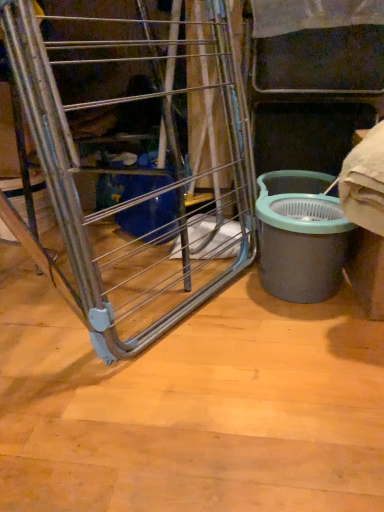
Where is `matte gray bucket at right`? The height and width of the screenshot is (512, 384). matte gray bucket at right is located at coordinates (300, 236).

Measure the distance between point (291, 175) and camera.

They are 1.21 meters apart.

This screenshot has height=512, width=384. What do you see at coordinates (300, 236) in the screenshot? I see `matte gray bucket at right` at bounding box center [300, 236].

This screenshot has height=512, width=384. Describe the element at coordinates (136, 169) in the screenshot. I see `metallic silver ladder at center` at that location.

Locate an element on the screen. Image resolution: width=384 pixels, height=512 pixels. metallic silver ladder at center is located at coordinates (136, 169).

You are a GUI agent. You are given a task and a screenshot of the screen. Output one action in this format:
    pyautogui.click(x=<x>, y=<y>)
    Task: Click on the matte gray bucket at right
    The width and height of the screenshot is (384, 512).
    Given the screenshot: What is the action you would take?
    pyautogui.click(x=300, y=236)

Is matte gray bucket at right to the right of metallic silver ladder at center from the viewer's perspective?

Yes.

Which object is closer to the camera, matte gray bucket at right or metallic silver ladder at center?

metallic silver ladder at center is in front.

Considering the points (284, 239) and (23, 232), which point is in front, point (284, 239) or point (23, 232)?

Positioned in front is point (23, 232).

Based on the photo, from the image's perspective, who appears lower, matte gray bucket at right or metallic silver ladder at center?

From the image's view, matte gray bucket at right is below.

From a real-world perspective, is matte gray bucket at right above or below metallic silver ladder at center?

matte gray bucket at right is situated lower than metallic silver ladder at center in the real world.

Does matte gray bucket at right have a lesser width compared to metallic silver ladder at center?

No.

Considering the relative sizes of matte gray bucket at right and metallic silver ladder at center in the image provided, is matte gray bucket at right shorter than metallic silver ladder at center?

Yes, matte gray bucket at right is shorter than metallic silver ladder at center.

Considering the relative sizes of matte gray bucket at right and metallic silver ladder at center in the image provided, is matte gray bucket at right bigger than metallic silver ladder at center?

Actually, matte gray bucket at right might be smaller than metallic silver ladder at center.

Would you say matte gray bucket at right is outside metallic silver ladder at center?

Yes, matte gray bucket at right is outside of metallic silver ladder at center.

Is matte gray bucket at right touching metallic silver ladder at center?

They are not placed beside each other.

Could you tell me if matte gray bucket at right is facing metallic silver ladder at center?

No, matte gray bucket at right does not turn towards metallic silver ladder at center.

What's the angular difference between matte gray bucket at right and metallic silver ladder at center's facing directions?

The angle between the facing direction of matte gray bucket at right and the facing direction of metallic silver ladder at center is 60.5 degrees.

Locate an element on the screen. This screenshot has height=512, width=384. waste container that is below the metallic silver ladder at center (from the image's perspective) is located at coordinates (300, 236).

Between metallic silver ladder at center and matte gray bucket at right, which one appears on the right side from the viewer's perspective?

From the viewer's perspective, matte gray bucket at right appears more on the right side.

Considering their positions, is metallic silver ladder at center located in front of or behind matte gray bucket at right?

In the image, metallic silver ladder at center appears in front of matte gray bucket at right.

Which is closer, (21, 59) or (321, 237)?

Point (21, 59) is positioned closer to the camera compared to point (321, 237).

From the image's perspective, which is below, metallic silver ladder at center or matte gray bucket at right?

matte gray bucket at right appears lower in the image.

From a real-world perspective, who is located lower, metallic silver ladder at center or matte gray bucket at right?

matte gray bucket at right is physically lower.

Is metallic silver ladder at center wider than matte gray bucket at right?

Incorrect, the width of metallic silver ladder at center does not surpass that of matte gray bucket at right.

Who is shorter, metallic silver ladder at center or matte gray bucket at right?

Standing shorter between the two is matte gray bucket at right.

Can you confirm if metallic silver ladder at center is smaller than matte gray bucket at right?

No.

Is metallic silver ladder at center positioned beyond the bounds of matte gray bucket at right?

Indeed, metallic silver ladder at center is completely outside matte gray bucket at right.

Is metallic silver ladder at center next to matte gray bucket at right?

No, metallic silver ladder at center is not in contact with matte gray bucket at right.

Looking at this image, is metallic silver ladder at center looking in the opposite direction of matte gray bucket at right?

No, matte gray bucket at right is not at the back of metallic silver ladder at center.

Consider the image. Can you tell me how much metallic silver ladder at center and matte gray bucket at right differ in facing direction?

metallic silver ladder at center and matte gray bucket at right are facing 60.5 degrees away from each other.

Identify the location of ladder on the left of the matte gray bucket at right. Image resolution: width=384 pixels, height=512 pixels. (136, 169).

Locate an element on the screen. The width and height of the screenshot is (384, 512). waste container on the right of metallic silver ladder at center is located at coordinates (300, 236).

At what (x,y) coordinates should I click in order to perform the action: click on waste container behind the metallic silver ladder at center. Please return your answer as a coordinate pair (x, y). Image resolution: width=384 pixels, height=512 pixels. Looking at the image, I should click on (300, 236).